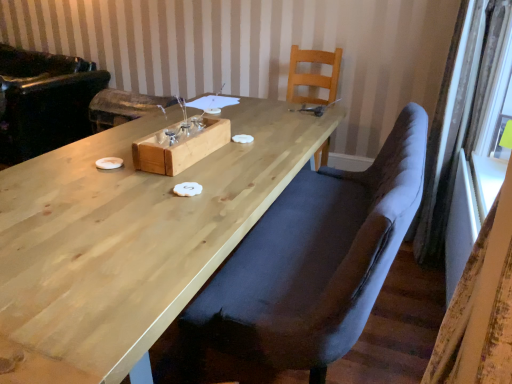
Question: Is velvet dark blue chair at center, the 1th chair positioned from the front, a part of black leather armchair at left?

Choices:
 (A) yes
 (B) no

Answer: (B)

Question: Is black leather armchair at left next to velvet dark blue chair at center, the 1th chair positioned from the front, and touching it?

Choices:
 (A) no
 (B) yes

Answer: (A)

Question: From the image's perspective, is black leather armchair at left under velvet dark blue chair at center, the 2th chair in the back-to-front sequence?

Choices:
 (A) no
 (B) yes

Answer: (A)

Question: From a real-world perspective, is black leather armchair at left on velvet dark blue chair at center, the 2th chair in the back-to-front sequence?

Choices:
 (A) yes
 (B) no

Answer: (B)

Question: Is black leather armchair at left facing away from velvet dark blue chair at center, the 1th chair positioned from the front?

Choices:
 (A) no
 (B) yes

Answer: (A)

Question: Is black leather armchair at left inside the boundaries of natural wood table at center, or outside?

Choices:
 (A) inside
 (B) outside

Answer: (B)

Question: From the image's perspective, is black leather armchair at left positioned above or below natural wood table at center?

Choices:
 (A) above
 (B) below

Answer: (A)

Question: In terms of width, does black leather armchair at left look wider or thinner when compared to natural wood table at center?

Choices:
 (A) thin
 (B) wide

Answer: (B)

Question: From a real-world perspective, is black leather armchair at left above or below natural wood table at center?

Choices:
 (A) above
 (B) below

Answer: (A)

Question: From a real-world perspective, is velvet curtain at right, acting as the 2th curtain starting from the bottom, physically located above or below velvet dark blue chair at center, the 2th chair in the back-to-front sequence?

Choices:
 (A) below
 (B) above

Answer: (B)

Question: From their relative heights in the image, would you say velvet curtain at right, acting as the 2th curtain starting from the bottom, is taller or shorter than velvet dark blue chair at center, the 2th chair in the back-to-front sequence?

Choices:
 (A) tall
 (B) short

Answer: (A)

Question: Considering the positions of velvet curtain at right, acting as the 2th curtain starting from the bottom, and velvet dark blue chair at center, the 2th chair in the back-to-front sequence, in the image, is velvet curtain at right, acting as the 2th curtain starting from the bottom, wider or thinner than velvet dark blue chair at center, the 2th chair in the back-to-front sequence,?

Choices:
 (A) thin
 (B) wide

Answer: (A)

Question: Relative to velvet dark blue chair at center, the 2th chair in the back-to-front sequence, is velvet curtain at right, positioned as the 1th curtain in top-to-bottom order, in front or behind?

Choices:
 (A) front
 (B) behind

Answer: (B)

Question: In terms of size, does yellowish fabric curtain at right, the 1th curtain ordered from the bottom, appear bigger or smaller than black leather armchair at left?

Choices:
 (A) big
 (B) small

Answer: (B)

Question: Is yellowish fabric curtain at right, the 1th curtain ordered from the bottom, inside the boundaries of black leather armchair at left, or outside?

Choices:
 (A) inside
 (B) outside

Answer: (B)